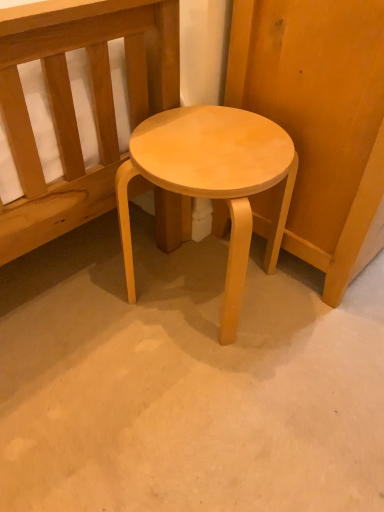
Where is `free space above light wood stool at center (from a real-world perspective)`? The width and height of the screenshot is (384, 512). free space above light wood stool at center (from a real-world perspective) is located at coordinates (212, 144).